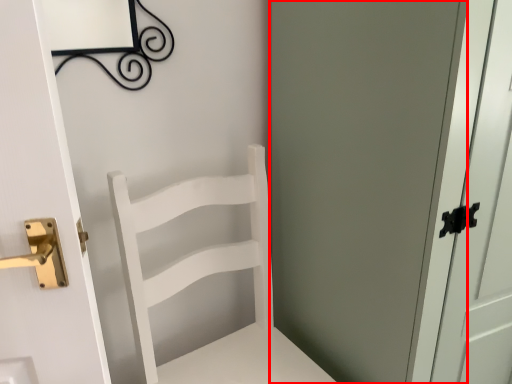
Question: From the image's perspective, considering the relative positions of screen door (annotated by the red box) and furniture in the image provided, where is screen door (annotated by the red box) located with respect to the staircase?

Choices:
 (A) above
 (B) below

Answer: (A)